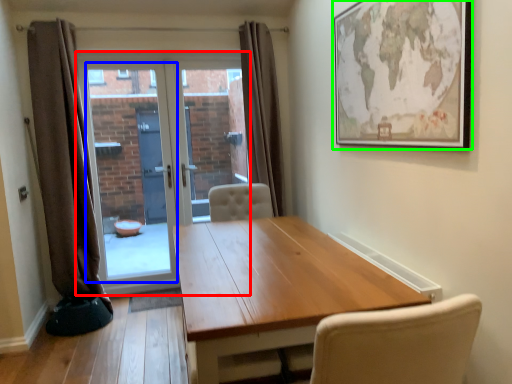
Question: Estimate the real-world distances between objects in this image. Which object is farther from door (highlighted by a red box), window screen (highlighted by a blue box) or picture frame (highlighted by a green box)?

Choices:
 (A) window screen
 (B) picture frame

Answer: (B)